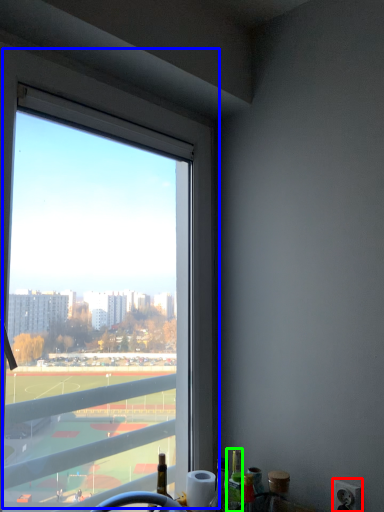
Question: Which object is positioned closest to power outlet (highlighted by a red box)? Select from window (highlighted by a blue box) and bottle (highlighted by a green box).

Choices:
 (A) window
 (B) bottle

Answer: (B)